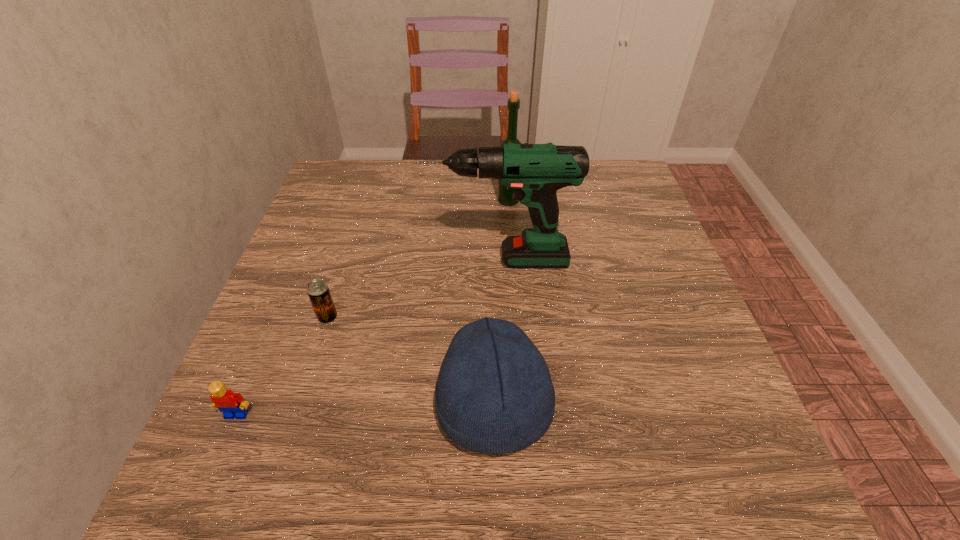
Identify the location of free space located on the back of the skullcap. The image size is (960, 540). (492, 299).

The height and width of the screenshot is (540, 960). I want to click on free spot located on the right of the second object from left to right, so click(368, 317).

You are a GUI agent. You are given a task and a screenshot of the screen. Output one action in this format:
    pyautogui.click(x=<x>, y=<y>)
    Task: Click on the object located in the far edge section of the desktop
    Image resolution: width=960 pixels, height=540 pixels.
    Given the screenshot: What is the action you would take?
    pyautogui.click(x=504, y=195)

Image resolution: width=960 pixels, height=540 pixels. What are the coordinates of `object positioned at the near edge` in the screenshot? It's located at (494, 395).

The image size is (960, 540). I want to click on beer can positioned at the left edge, so click(x=318, y=291).

I want to click on Lego present at the left edge, so click(232, 405).

In the image, there is a desktop. At what (x,y) coordinates should I click in order to perform the action: click on free space at the far edge. Please return your answer as a coordinate pair (x, y). The image size is (960, 540). Looking at the image, I should click on (571, 198).

At what (x,y) coordinates should I click in order to perform the action: click on free location at the near edge of the desktop. Please return your answer as a coordinate pair (x, y). Looking at the image, I should click on (406, 470).

In the image, there is a desktop. Where is `vacant space at the left edge`? vacant space at the left edge is located at coordinates (285, 274).

Locate an element on the screen. The height and width of the screenshot is (540, 960). vacant region at the right edge of the desktop is located at coordinates (620, 217).